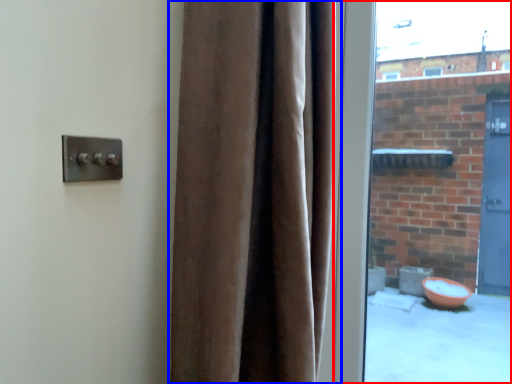
Question: Which object is further to the camera taking this photo, window (highlighted by a red box) or curtain (highlighted by a blue box)?

Choices:
 (A) window
 (B) curtain

Answer: (A)